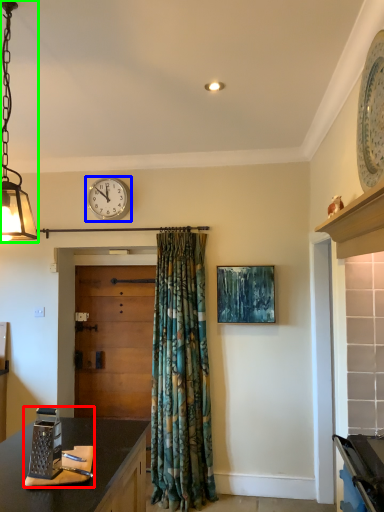
Question: Estimate the real-world distances between objects in this image. Which object is farther from appliance (highlighted by a red box), wall clock (highlighted by a blue box) or lamp (highlighted by a green box)?

Choices:
 (A) wall clock
 (B) lamp

Answer: (A)